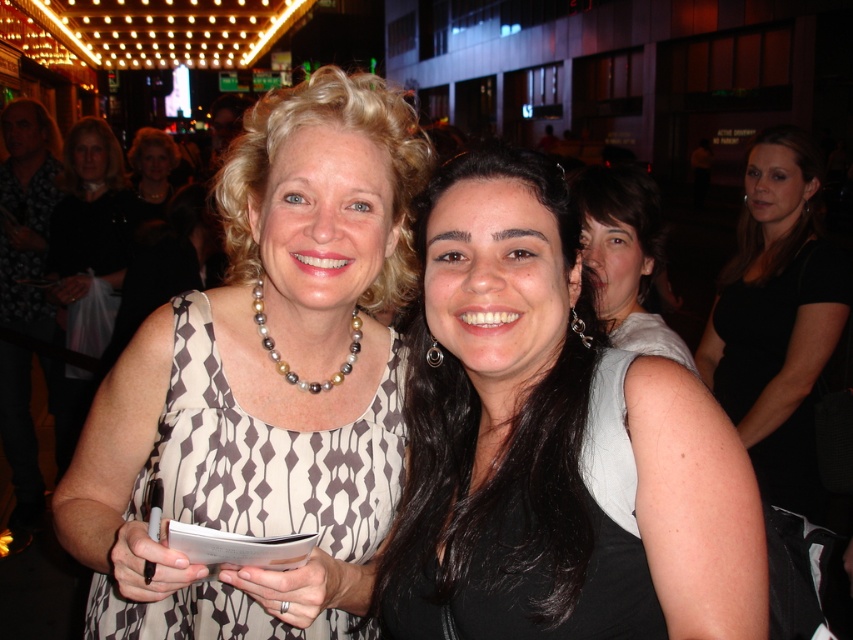
You are standing at the entrance of the event and want to take a photo of the point at coordinates point [515,508]. Your camera has a focal length of 50mm and a sensor size of 24mm x 36mm. What is the minimum distance you need to be from the point to ensure it fills the frame vertically? Use the formula for calculating the minimum distance required for a subject to fill the frame vertically, which is distance equals sensor height divided by twice the tangent of half the focal length angle. The sensor is

The point at coordinates point [515,508] is 3.85 feet from the viewer. To calculate the minimum distance needed, use the formula distance equals sensor height divided by twice the tangent of half the focal length angle. Plugging in the values, the sensor height is 24mm, focal length is 50mm. The angle of view can be calculated using arctangent of sensor height divided by focal length, which gives approximately 28 degrees. Half of that is 14 degrees. Taking the tangent of 14 degrees gives approximately 0.

In the scene shown: You are at the event and want to take a photo of both the black matte dress at center and the black dress at center. Which one should you focus on first if you want to capture them in order from left to right?

You should focus on the black matte dress at center first since it is to the left of the black dress at center.